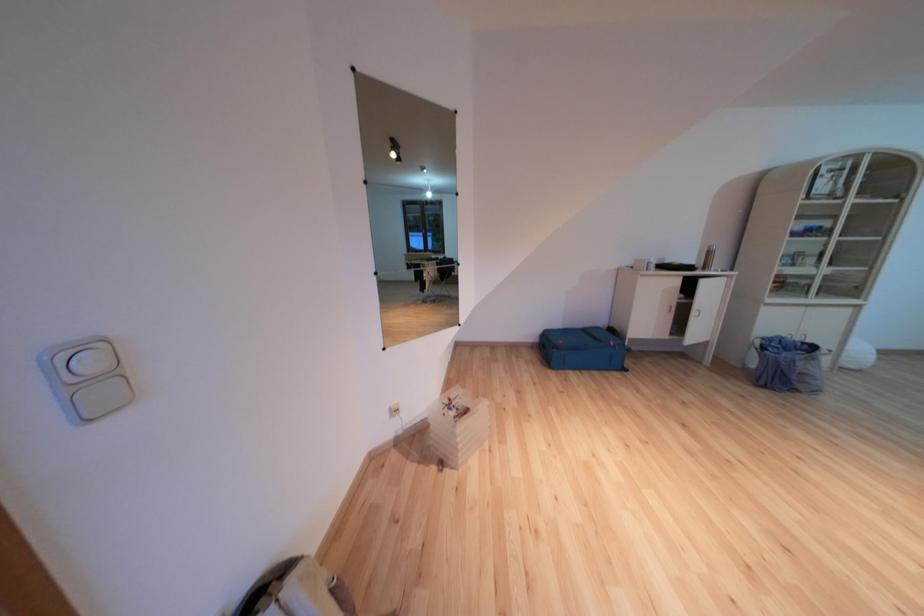
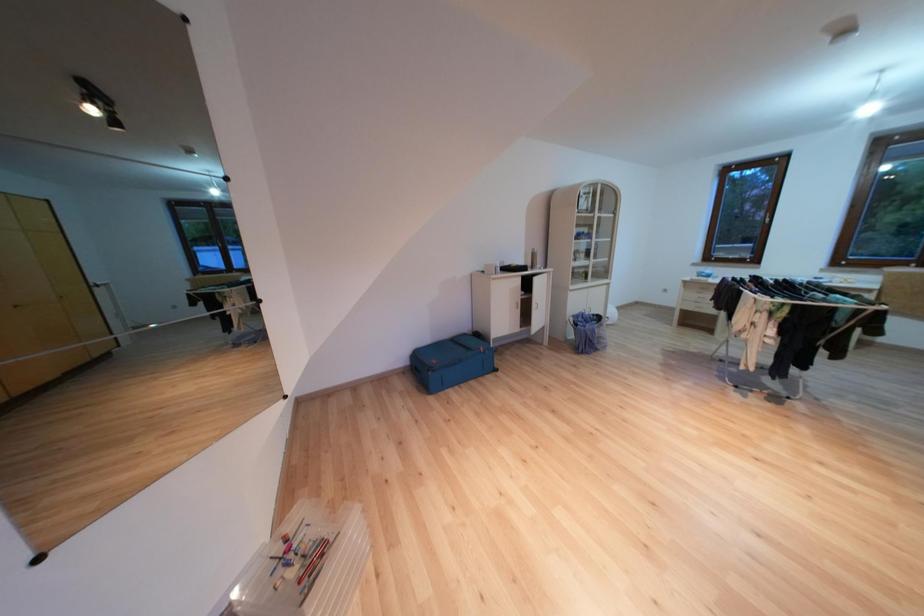
Question: The camera is either moving clockwise (left) or counter-clockwise (right) around the object. The first image is from the beginning of the video and the second image is from the end. Is the camera moving left or right when shooting the video?

Choices:
 (A) Left
 (B) Right

Answer: (A)